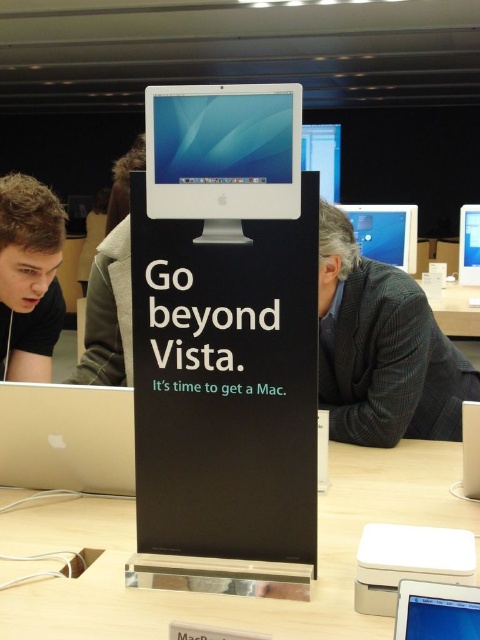
You are standing in front of the promotional stand at the Apple store. There are two points marked on the stand. The first point is at coordinates point (375,211) and the second point is at point (467,224). If you were to touch both points with your finger, which point would feel closer to your hand?

Point (375,211) is closer to the camera than point (467,224), so when you touch them, point (375,211) will feel closer to your hand.

You are a customer standing in front of the promotional stand. You want to touch the clear acrylic table at center and the white glossy monitor at center. Which object can you reach first without moving your position?

The clear acrylic table at center is closer to the viewer than the white glossy monitor at center, so you can reach the clear acrylic table at center first without moving.

You are an interior designer planning to move a large potted plant between the clear acrylic table at center and the white glossy monitor at center. Given that the plant requires 30 inches of space to fit comfortably, will there be enough space between them?

The clear acrylic table at center is 29.69 inches away from the white glossy monitor at center. Since the required space is 30 inches, there is insufficient space for the plant to fit comfortably between them.